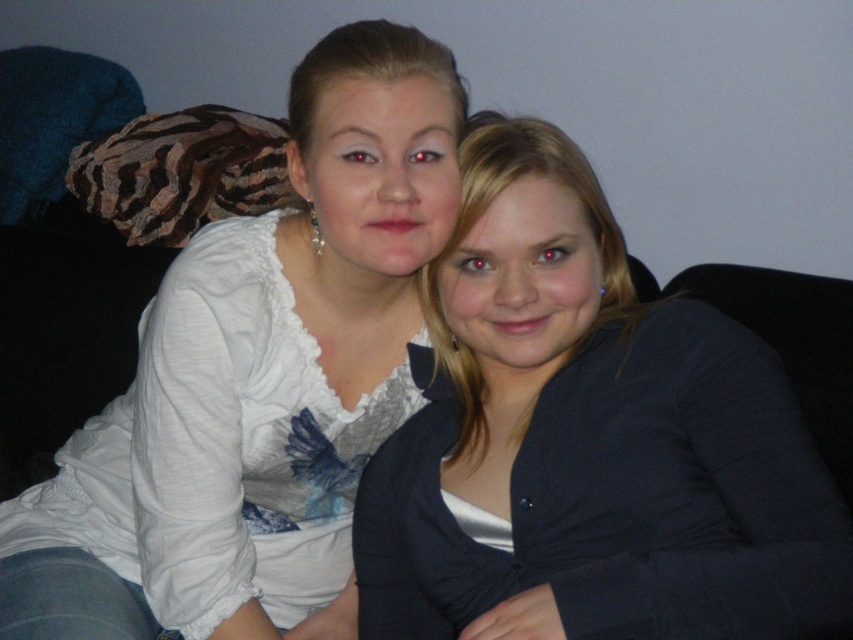
Question: Is matte black blazer at center bigger than white satin blouse at upper left?

Choices:
 (A) yes
 (B) no

Answer: (B)

Question: Can you confirm if matte black blazer at center is bigger than white satin blouse at upper left?

Choices:
 (A) no
 (B) yes

Answer: (A)

Question: Which point is farther from the camera taking this photo?

Choices:
 (A) (743, 412)
 (B) (357, 212)

Answer: (A)

Question: Is matte black blazer at center positioned before white satin blouse at upper left?

Choices:
 (A) yes
 (B) no

Answer: (A)